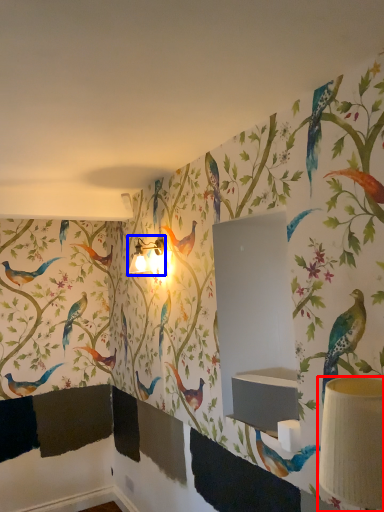
Question: Which object appears farthest to the camera in this image, table lamp (highlighted by a red box) or table lamp (highlighted by a blue box)?

Choices:
 (A) table lamp
 (B) table lamp

Answer: (B)